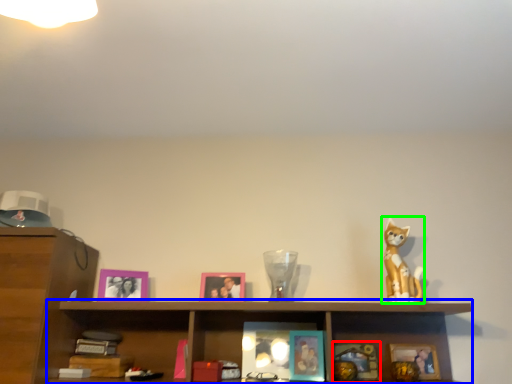
Question: Estimate the real-world distances between objects in this image. Which object is closer to picture frame (highlighted by a red box), cabinet (highlighted by a blue box) or toy (highlighted by a green box)?

Choices:
 (A) cabinet
 (B) toy

Answer: (B)